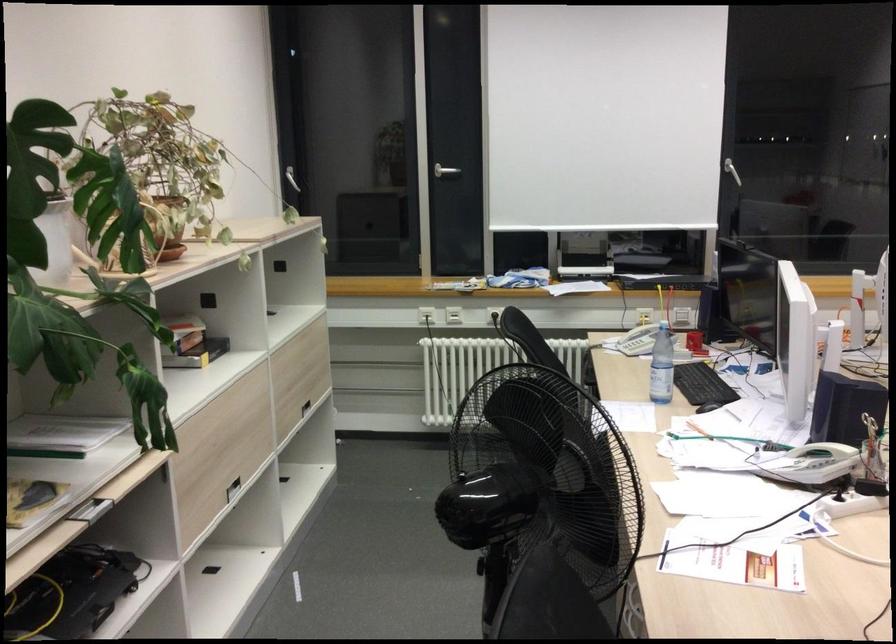
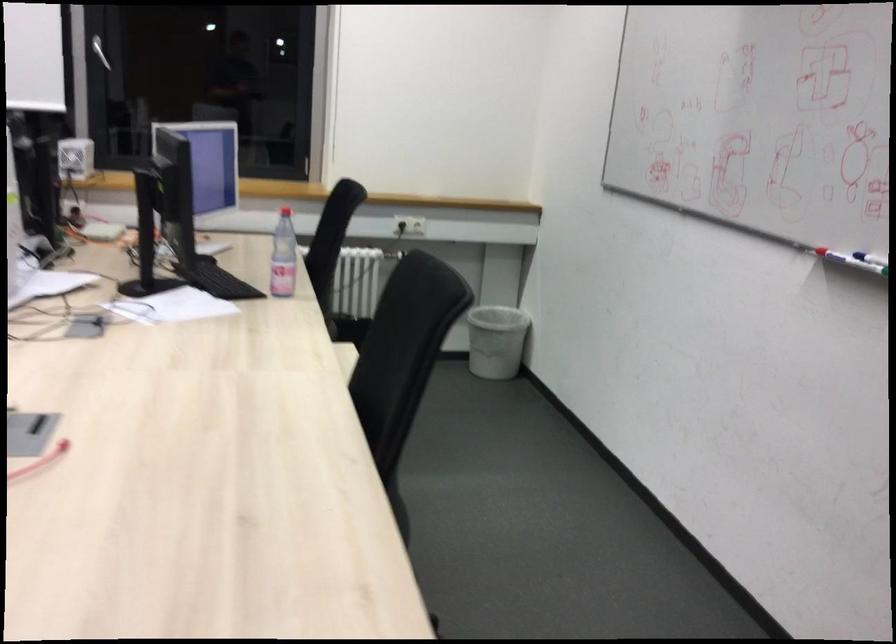
Question: In a continuous first-person perspective shot, in which direction is the camera moving?

Choices:
 (A) Left
 (B) Right
 (C) Forward
 (D) Backward

Answer: (B)